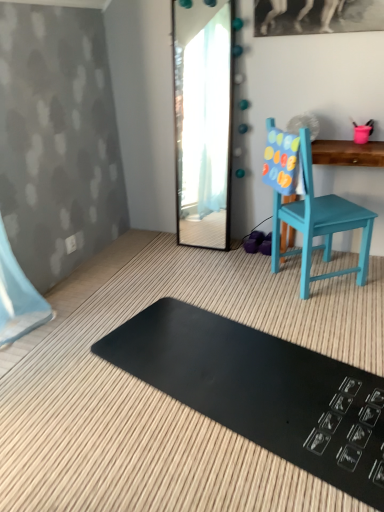
What do you see at coordinates (260, 390) in the screenshot?
I see `black rubber mat at lower center` at bounding box center [260, 390].

Describe the element at coordinates (348, 153) in the screenshot. The height and width of the screenshot is (512, 384). I see `teal painted wood changing table at right` at that location.

This screenshot has height=512, width=384. I want to click on teal painted wood changing table at right, so click(x=348, y=153).

This screenshot has width=384, height=512. I want to click on black rubber mat at lower center, so click(260, 390).

Is black rubber mat at lower center bigger or smaller than clear glass mirror at center?

In the image, black rubber mat at lower center appears to be smaller than clear glass mirror at center.

Is point (267, 443) more distant than point (182, 165)?

No, it is not.

Can you tell me how much black rubber mat at lower center and clear glass mirror at center differ in facing direction?

The facing directions of black rubber mat at lower center and clear glass mirror at center are 74.4 degrees apart.

Could you tell me if black rubber mat at lower center is turned towards clear glass mirror at center?

No, black rubber mat at lower center is not oriented towards clear glass mirror at center.

Is black rubber mat at lower center taller or shorter than teal painted wood changing table at right?

In the image, black rubber mat at lower center appears to be shorter than teal painted wood changing table at right.

Is black rubber mat at lower center turned away from teal painted wood changing table at right?

black rubber mat at lower center is not turned away from teal painted wood changing table at right.

Does black rubber mat at lower center have a smaller size compared to teal painted wood changing table at right?

Indeed, black rubber mat at lower center has a smaller size compared to teal painted wood changing table at right.

Looking at this image, is the position of black rubber mat at lower center more distant than that of teal painted wood changing table at right?

No.

The image size is (384, 512). What are the coordinates of `mat below the clear glass mirror at center (from a real-world perspective)` in the screenshot? It's located at (260, 390).

Is clear glass mirror at center in front of or behind black rubber mat at lower center in the image?

Visually, clear glass mirror at center is located behind black rubber mat at lower center.

From a real-world perspective, who is located lower, clear glass mirror at center or black rubber mat at lower center?

black rubber mat at lower center, from a real-world perspective.

Considering the relative positions of clear glass mirror at center and black rubber mat at lower center in the image provided, is clear glass mirror at center to the left of black rubber mat at lower center from the viewer's perspective?

Yes, clear glass mirror at center is to the left of black rubber mat at lower center.

Is teal painted wood chair at right taller than teal painted wood changing table at right?

Yes.

Which is more to the left, teal painted wood chair at right or teal painted wood changing table at right?

From the viewer's perspective, teal painted wood chair at right appears more on the left side.

From a real-world perspective, is teal painted wood chair at right positioned over teal painted wood changing table at right based on gravity?

Yes, from a real-world perspective, teal painted wood chair at right is above teal painted wood changing table at right.

What's the angular difference between black rubber mat at lower center and teal painted wood chair at right's facing directions?

The angle between the facing direction of black rubber mat at lower center and the facing direction of teal painted wood chair at right is 54.6 degrees.

Is black rubber mat at lower center aimed at teal painted wood chair at right?

No.

Choose the correct answer: Is black rubber mat at lower center inside teal painted wood chair at right or outside it?

black rubber mat at lower center is not enclosed by teal painted wood chair at right.

Is black rubber mat at lower center closer to camera compared to teal painted wood chair at right?

Yes.

Identify the location of mirror that appears above the teal painted wood changing table at right (from the image's perspective). (203, 120).

Is clear glass mirror at center aimed at teal painted wood changing table at right?

No, clear glass mirror at center is not facing towards teal painted wood changing table at right.

From the image's perspective, which is below, clear glass mirror at center or teal painted wood changing table at right?

From the image's view, teal painted wood changing table at right is below.

Considering the relative sizes of clear glass mirror at center and teal painted wood changing table at right in the image provided, is clear glass mirror at center smaller than teal painted wood changing table at right?

Yes.

Is teal painted wood changing table at right not inside teal painted wood chair at right?

teal painted wood changing table at right lies outside teal painted wood chair at right's area.

Is teal painted wood changing table at right bigger than teal painted wood chair at right?

No, teal painted wood changing table at right is not bigger than teal painted wood chair at right.

Is teal painted wood changing table at right directly adjacent to teal painted wood chair at right?

There is a gap between teal painted wood changing table at right and teal painted wood chair at right.

How far apart are teal painted wood changing table at right and teal painted wood chair at right?

teal painted wood changing table at right and teal painted wood chair at right are 13.48 inches apart.

This screenshot has width=384, height=512. I want to click on mirror behind the black rubber mat at lower center, so click(203, 120).

Locate an element on the screen. Image resolution: width=384 pixels, height=512 pixels. changing table on the right side of black rubber mat at lower center is located at coordinates (348, 153).

Which object lies nearer to the anchor point black rubber mat at lower center, clear glass mirror at center or teal painted wood changing table at right?

The object closer to black rubber mat at lower center is teal painted wood changing table at right.

Considering their positions, is clear glass mirror at center positioned closer to teal painted wood changing table at right than teal painted wood chair at right?

teal painted wood chair at right lies closer to teal painted wood changing table at right than the other object.

When comparing their distances from black rubber mat at lower center, does teal painted wood changing table at right or clear glass mirror at center seem further?

The object further to black rubber mat at lower center is clear glass mirror at center.

Estimate the real-world distances between objects in this image. Which object is closer to teal painted wood changing table at right, teal painted wood chair at right or black rubber mat at lower center?

teal painted wood chair at right.

Looking at the image, which one is located further to teal painted wood chair at right, teal painted wood changing table at right or black rubber mat at lower center?

Among the two, black rubber mat at lower center is located further to teal painted wood chair at right.

Based on their spatial positions, is clear glass mirror at center or black rubber mat at lower center further from teal painted wood chair at right?

The object further to teal painted wood chair at right is clear glass mirror at center.

Based on the photo, when comparing their distances from teal painted wood changing table at right, does black rubber mat at lower center or teal painted wood chair at right seem further?

The object further to teal painted wood changing table at right is black rubber mat at lower center.

Looking at the image, which one is located closer to teal painted wood chair at right, clear glass mirror at center or teal painted wood changing table at right?

teal painted wood changing table at right.

The height and width of the screenshot is (512, 384). Find the location of `chair located between black rubber mat at lower center and teal painted wood changing table at right in the depth direction`. chair located between black rubber mat at lower center and teal painted wood changing table at right in the depth direction is located at coordinates (319, 224).

Locate an element on the screen. The image size is (384, 512). chair between clear glass mirror at center and black rubber mat at lower center in the up-down direction is located at coordinates (319, 224).

Where is `changing table between clear glass mirror at center and teal painted wood chair at right in the up-down direction`? This screenshot has width=384, height=512. changing table between clear glass mirror at center and teal painted wood chair at right in the up-down direction is located at coordinates (348, 153).

The height and width of the screenshot is (512, 384). I want to click on changing table between clear glass mirror at center and black rubber mat at lower center in the up-down direction, so click(x=348, y=153).